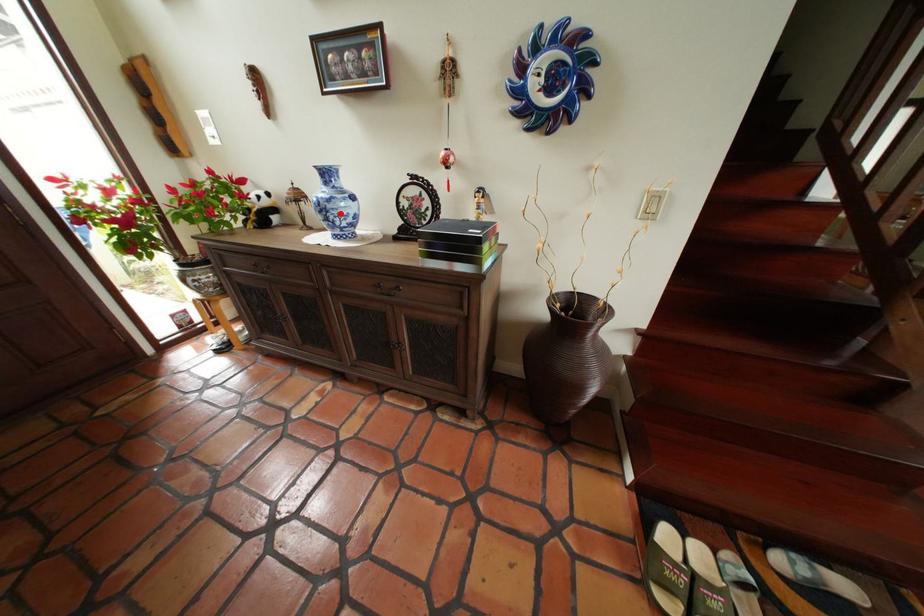
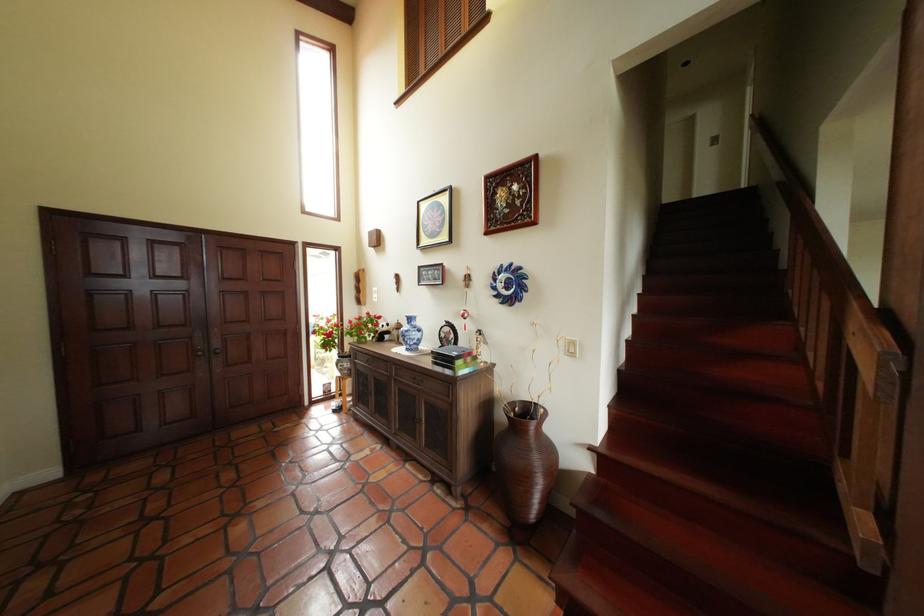
Locate, in the second image, the point that corresponds to the highlighted location in the first image.

(418, 338)